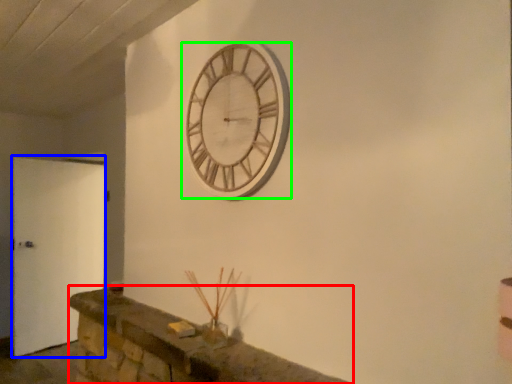
Question: Which is nearer to the mantle (highlighted by a red box)? door (highlighted by a blue box) or wall clock (highlighted by a green box).

Choices:
 (A) door
 (B) wall clock

Answer: (B)